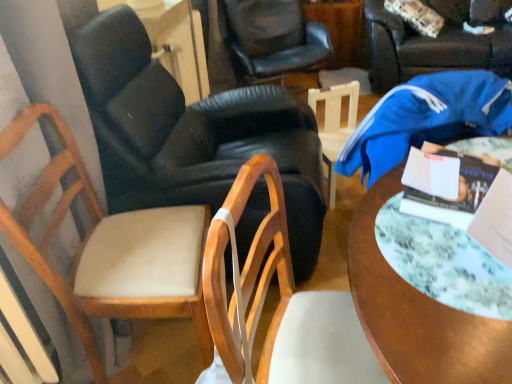
Question: Does leather armchair at center, which appears as the second chair when viewed from the left, have a larger size compared to hardcover book at center right?

Choices:
 (A) no
 (B) yes

Answer: (B)

Question: From the image's perspective, is leather armchair at center, the fifth chair viewed from the right, below hardcover book at center right?

Choices:
 (A) yes
 (B) no

Answer: (B)

Question: Would you say leather armchair at center, which appears as the second chair when viewed from the left, contains hardcover book at center right?

Choices:
 (A) no
 (B) yes

Answer: (A)

Question: Can you confirm if leather armchair at center, which appears as the second chair when viewed from the left, is wider than hardcover book at center right?

Choices:
 (A) yes
 (B) no

Answer: (A)

Question: Considering the relative positions of leather armchair at center, the fifth chair viewed from the right, and hardcover book at center right in the image provided, is leather armchair at center, the fifth chair viewed from the right, behind hardcover book at center right?

Choices:
 (A) no
 (B) yes

Answer: (B)

Question: From the image's perspective, would you say leather armchair at center, which appears as the second chair when viewed from the left, is positioned over hardcover book at center right?

Choices:
 (A) yes
 (B) no

Answer: (A)

Question: Does wooden round table at center appear on the left side of black leather chair at center, the fourth chair from the right?

Choices:
 (A) yes
 (B) no

Answer: (B)

Question: Does wooden round table at center have a smaller size compared to black leather chair at center, placed as the third chair when sorted from left to right?

Choices:
 (A) yes
 (B) no

Answer: (A)

Question: Can you confirm if wooden round table at center is taller than black leather chair at center, the fourth chair from the right?

Choices:
 (A) yes
 (B) no

Answer: (B)

Question: Could black leather chair at center, the fourth chair from the right, be considered to be inside wooden round table at center?

Choices:
 (A) no
 (B) yes

Answer: (A)

Question: Considering the relative sizes of wooden round table at center and black leather chair at center, the fourth chair from the right, in the image provided, is wooden round table at center wider than black leather chair at center, the fourth chair from the right,?

Choices:
 (A) no
 (B) yes

Answer: (A)

Question: Considering the relative positions of wooden round table at center and black leather chair at center, placed as the third chair when sorted from left to right, in the image provided, is wooden round table at center in front of black leather chair at center, placed as the third chair when sorted from left to right,?

Choices:
 (A) no
 (B) yes

Answer: (B)

Question: Can you confirm if light brown wood chair at left, which ranks as the 1th chair in left-to-right order, is thinner than hardcover book at center right?

Choices:
 (A) yes
 (B) no

Answer: (B)